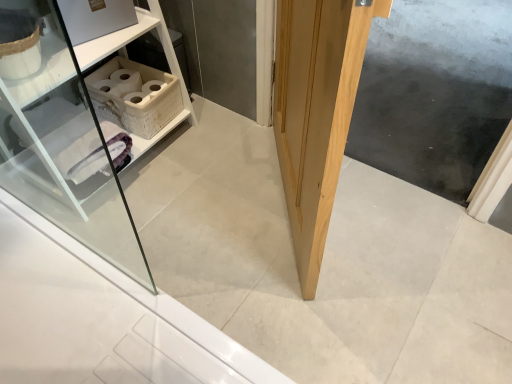
Question: From the image's perspective, is white wicker shelf at upper left on natural wood door at center?

Choices:
 (A) yes
 (B) no

Answer: (A)

Question: Is there a large distance between white wicker shelf at upper left and natural wood door at center?

Choices:
 (A) yes
 (B) no

Answer: (B)

Question: Considering the relative sizes of white wicker shelf at upper left and natural wood door at center in the image provided, is white wicker shelf at upper left wider than natural wood door at center?

Choices:
 (A) yes
 (B) no

Answer: (A)

Question: From a real-world perspective, does white wicker shelf at upper left sit lower than natural wood door at center?

Choices:
 (A) no
 (B) yes

Answer: (B)

Question: Does white wicker shelf at upper left lie behind natural wood door at center?

Choices:
 (A) yes
 (B) no

Answer: (A)

Question: From the image's perspective, is white wicker shelf at upper left positioned above or below natural wood door at center?

Choices:
 (A) above
 (B) below

Answer: (A)

Question: Based on their sizes in the image, would you say white wicker shelf at upper left is bigger or smaller than natural wood door at center?

Choices:
 (A) big
 (B) small

Answer: (A)

Question: Is white wicker shelf at upper left situated inside natural wood door at center or outside?

Choices:
 (A) inside
 (B) outside

Answer: (B)

Question: In the image, is white wicker shelf at upper left on the left side or the right side of natural wood door at center?

Choices:
 (A) right
 (B) left

Answer: (B)

Question: Considering the relative positions of natural wood screen door at center and natural wood door at center in the image provided, is natural wood screen door at center to the left or to the right of natural wood door at center?

Choices:
 (A) left
 (B) right

Answer: (B)

Question: In terms of size, does natural wood screen door at center appear bigger or smaller than natural wood door at center?

Choices:
 (A) big
 (B) small

Answer: (B)

Question: Which is correct: natural wood screen door at center is inside natural wood door at center, or outside of it?

Choices:
 (A) inside
 (B) outside

Answer: (B)

Question: Is natural wood screen door at center wider or thinner than natural wood door at center?

Choices:
 (A) wide
 (B) thin

Answer: (A)

Question: Relative to natural wood door at center, is white wicker basket at upper left in front or behind?

Choices:
 (A) front
 (B) behind

Answer: (B)

Question: Is white wicker basket at upper left wider or thinner than natural wood door at center?

Choices:
 (A) thin
 (B) wide

Answer: (B)